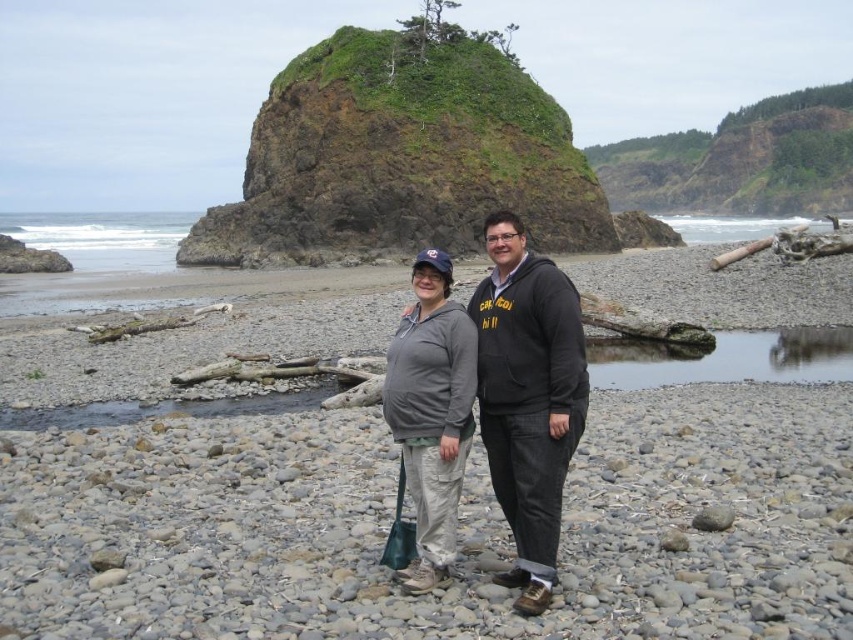
You are a photographer trying to capture the smooth pebbles at center and the gray fleece sweatshirt at center in the same frame. Based on their positions, which object should you focus on first to ensure both are in focus?

The smooth pebbles at center are above the gray fleece sweatshirt at center, so you should focus on the smooth pebbles at center first to ensure both are in focus.

You are standing on a beach and see two points marked on the ground. The first point is at coordinates point (573, 442) and the second point is at point (445, 268). If you want to walk towards the rock formation behind the people, which point should you step on first?

You should step on point (573, 442) first because it is in front of point (445, 268), meaning it is closer to your current position on the beach and closer to the rock formation behind the people.

You are standing on the beach and want to place a small flag at the point marked as point (457, 531). According to the scene description, where exactly should you place the flag?

The point (457, 531) is on smooth pebbles at center, so you should place the flag on the smooth pebbles located at the center of the beach.